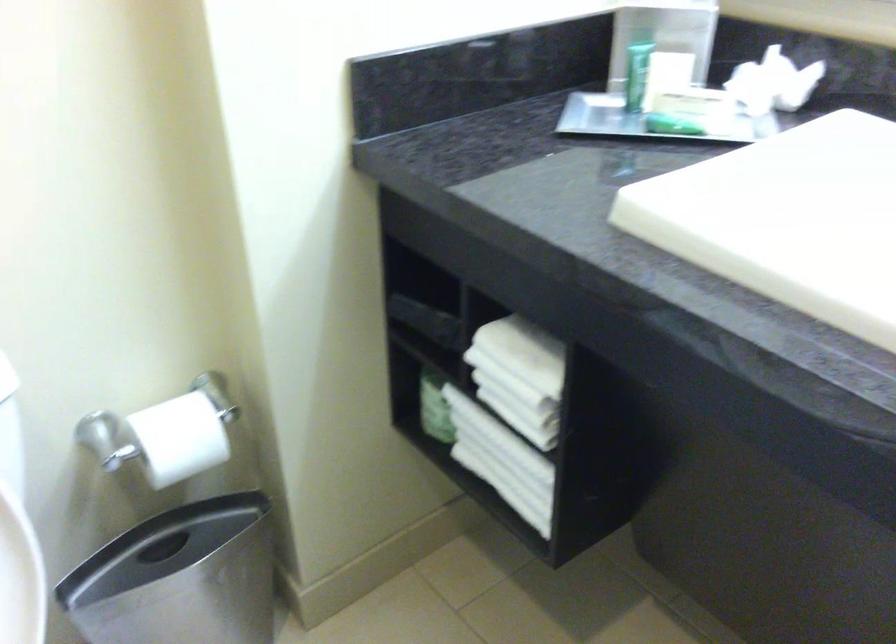
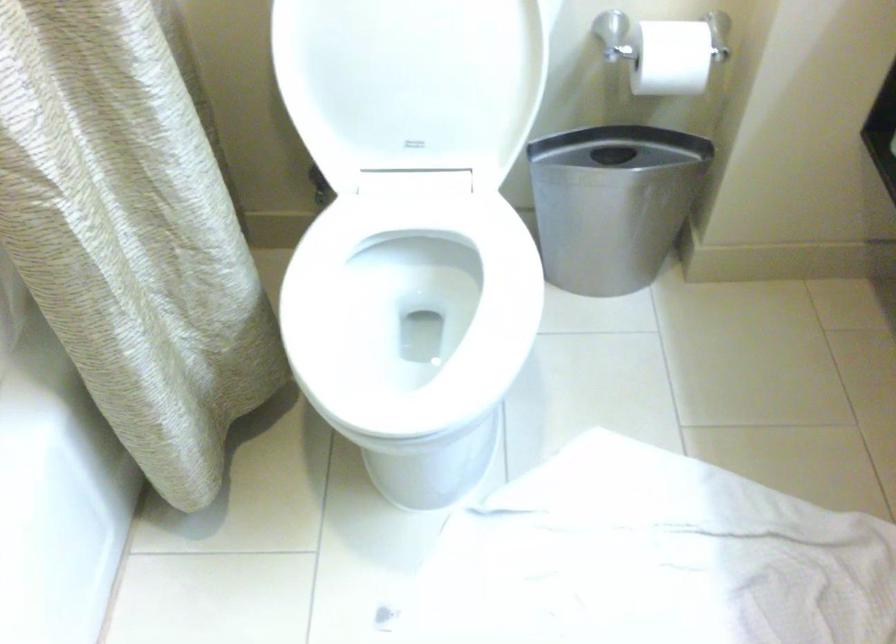
The first image is from the beginning of the video and the second image is from the end. How did the camera likely rotate when shooting the video?

The rotation direction of the camera is left-down.